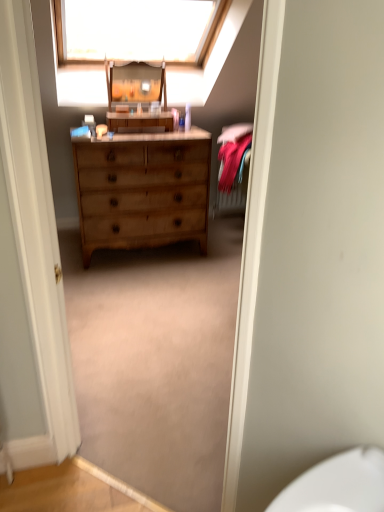
Question: Can you confirm if wooden changing table at center is positioned to the right of white fabric at upper center?

Choices:
 (A) yes
 (B) no

Answer: (B)

Question: From a real-world perspective, is wooden changing table at center located higher than white fabric at upper center?

Choices:
 (A) yes
 (B) no

Answer: (B)

Question: Could white fabric at upper center be considered to be inside wooden changing table at center?

Choices:
 (A) yes
 (B) no

Answer: (B)

Question: Does wooden changing table at center have a greater width compared to white fabric at upper center?

Choices:
 (A) no
 (B) yes

Answer: (A)

Question: Is wooden changing table at center oriented away from white fabric at upper center?

Choices:
 (A) no
 (B) yes

Answer: (A)

Question: From the image's perspective, would you say wooden changing table at center is positioned over white fabric at upper center?

Choices:
 (A) no
 (B) yes

Answer: (A)

Question: From the image's perspective, is light brown wood dresser at center on top of wooden changing table at center?

Choices:
 (A) yes
 (B) no

Answer: (B)

Question: Does light brown wood dresser at center have a greater height compared to wooden changing table at center?

Choices:
 (A) no
 (B) yes

Answer: (B)

Question: Is light brown wood dresser at center at the right side of wooden changing table at center?

Choices:
 (A) yes
 (B) no

Answer: (B)

Question: Can you confirm if light brown wood dresser at center is smaller than wooden changing table at center?

Choices:
 (A) yes
 (B) no

Answer: (B)

Question: From the image's perspective, does light brown wood dresser at center appear lower than wooden changing table at center?

Choices:
 (A) yes
 (B) no

Answer: (A)

Question: From a real-world perspective, is light brown wood dresser at center located higher than wooden changing table at center?

Choices:
 (A) yes
 (B) no

Answer: (B)

Question: Does wooden dresser at center lie behind white fabric at upper center?

Choices:
 (A) yes
 (B) no

Answer: (A)